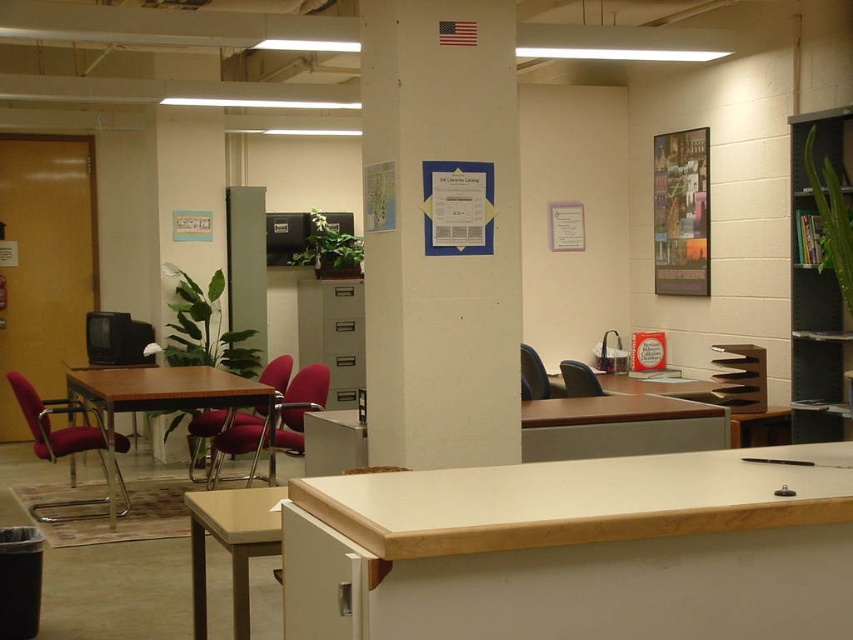
You are standing at the entrance of the office and want to reach the wooden table at center. Which direction should you walk to get there?

Since the wooden table at center is located at coordinates point 0.623 on the x axis and 0.189 on the y axis, you should walk towards the center of the room to reach it.

You are organizing a meeting in the office and need to position the wooden table at center and the matte plastic chair at center. Based on their positions, which object is on the right side when facing the front of the room?

The matte plastic chair at center is on the right side because the wooden table at center is to its left.